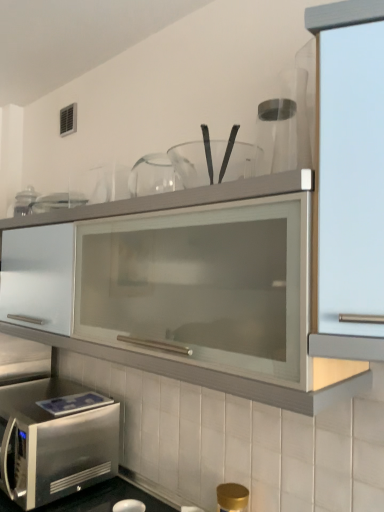
Question: Is point (372, 271) positioned closer to the camera than point (206, 142)?

Choices:
 (A) farther
 (B) closer

Answer: (B)

Question: From the image's perspective, is satin glass cabinet at right above or below transparent glass jar at upper center?

Choices:
 (A) below
 (B) above

Answer: (A)

Question: Which object is the farthest from the satin glass cabinet at right?

Choices:
 (A) transparent glass jar at upper center
 (B) stainless steel microwave at lower left

Answer: (B)

Question: Based on their relative distances, which object is farther from the transparent glass jar at upper center?

Choices:
 (A) stainless steel microwave at lower left
 (B) satin glass cabinet at right

Answer: (A)